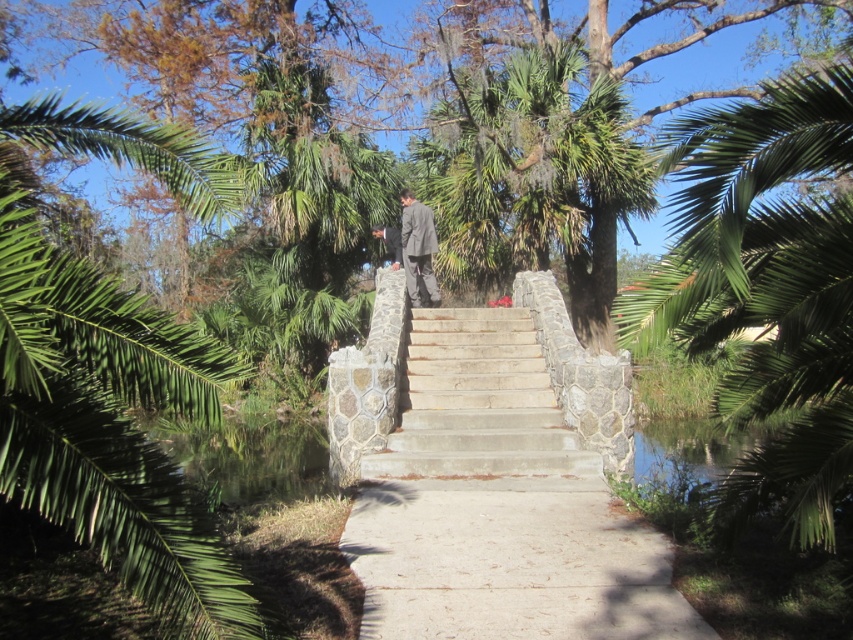
You are standing at the point labeled as point (498, 504) in the image. What is the surface material under your feet?

The surface material under your feet at point (498, 504) is concrete and stone path at center.

You are standing at the base of the stone staircase leading to the bridge. You notice two points marked in the scene. Which point, point (438, 573) or point (407, 220), is closer to you?

Point (438, 573) is closer to the camera than point (407, 220), so the point closer to you is point (438, 573).